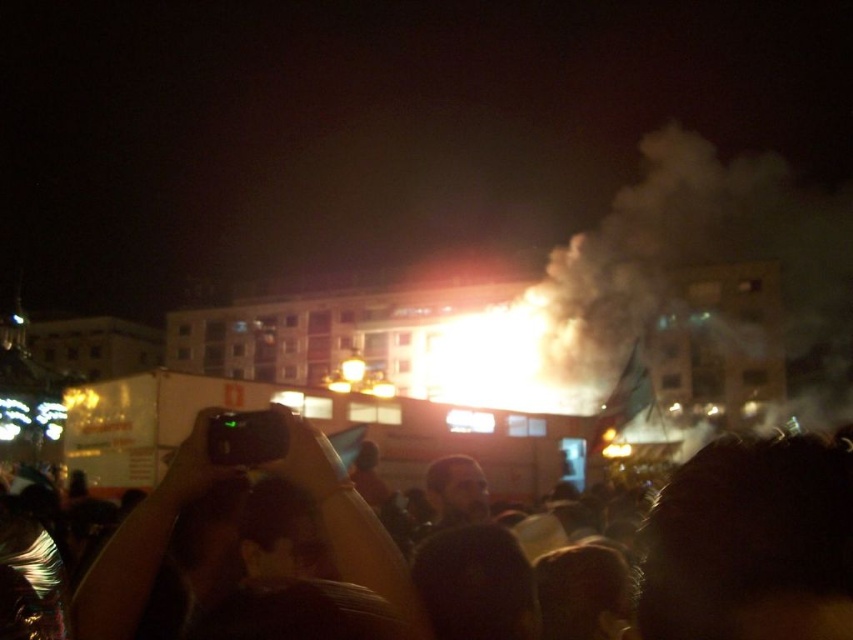
Who is lower down, smokesmoky/black at upper center or matte black camera at center?

matte black camera at center is lower down.

Between smokesmoky/black at upper center and matte black camera at center, which one has more height?

Standing taller between the two is smokesmoky/black at upper center.

Describe the element at coordinates (685, 289) in the screenshot. I see `smokesmoky/black at upper center` at that location.

At what (x,y) coordinates should I click in order to perform the action: click on smokesmoky/black at upper center. Please return your answer as a coordinate pair (x, y). The image size is (853, 640). Looking at the image, I should click on (685, 289).

The image size is (853, 640). What do you see at coordinates (751, 544) in the screenshot? I see `black matte crowd at center` at bounding box center [751, 544].

Is black matte crowd at center wider than matte black camera at center?

Indeed, black matte crowd at center has a greater width compared to matte black camera at center.

You are a GUI agent. You are given a task and a screenshot of the screen. Output one action in this format:
    pyautogui.click(x=<x>, y=<y>)
    Task: Click on the black matte crowd at center
    This screenshot has width=853, height=640.
    Given the screenshot: What is the action you would take?
    pyautogui.click(x=751, y=544)

Can you confirm if black matte crowd at center is thinner than smokesmoky/black at upper center?

Indeed, black matte crowd at center has a lesser width compared to smokesmoky/black at upper center.

Who is more forward, (727, 529) or (653, 189)?

Point (727, 529) is in front.

Find the location of a particular element. The height and width of the screenshot is (640, 853). black matte crowd at center is located at coordinates (751, 544).